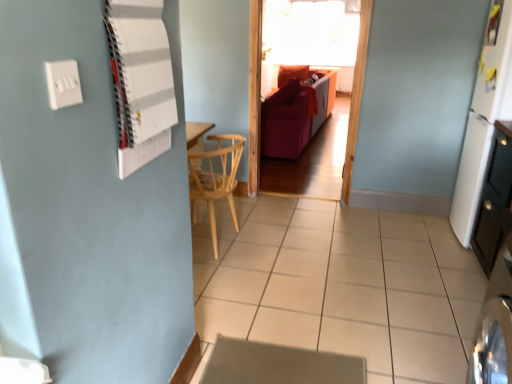
Question: From the image's perspective, is velvet red couch at center above beige carpet at lower center?

Choices:
 (A) no
 (B) yes

Answer: (B)

Question: Is velvet red couch at center surrounding beige carpet at lower center?

Choices:
 (A) no
 (B) yes

Answer: (A)

Question: Is velvet red couch at center outside of beige carpet at lower center?

Choices:
 (A) no
 (B) yes

Answer: (B)

Question: Is velvet red couch at center not close to beige carpet at lower center?

Choices:
 (A) no
 (B) yes

Answer: (B)

Question: Considering the relative sizes of velvet red couch at center and beige carpet at lower center in the image provided, is velvet red couch at center smaller than beige carpet at lower center?

Choices:
 (A) no
 (B) yes

Answer: (A)

Question: In terms of width, does white matte board at upper left look wider or thinner when compared to natural wood chair at center?

Choices:
 (A) thin
 (B) wide

Answer: (A)

Question: Looking at the image, does white matte board at upper left seem bigger or smaller compared to natural wood chair at center?

Choices:
 (A) big
 (B) small

Answer: (B)

Question: Is point (156, 6) positioned closer to the camera than point (229, 198)?

Choices:
 (A) farther
 (B) closer

Answer: (B)

Question: From their relative heights in the image, would you say white matte board at upper left is taller or shorter than natural wood chair at center?

Choices:
 (A) tall
 (B) short

Answer: (B)

Question: Is point (268, 223) positioned closer to the camera than point (506, 205)?

Choices:
 (A) farther
 (B) closer

Answer: (A)

Question: Considering the relative positions of white tile at center and white glossy dresser at right in the image provided, is white tile at center to the left or to the right of white glossy dresser at right?

Choices:
 (A) right
 (B) left

Answer: (B)

Question: Considering their positions, is white tile at center located in front of or behind white glossy dresser at right?

Choices:
 (A) behind
 (B) front

Answer: (B)

Question: From the image's perspective, is white tile at center located above or below white glossy dresser at right?

Choices:
 (A) above
 (B) below

Answer: (B)

Question: From the image's perspective, is white plastic switch at upper left positioned above or below white matte board at upper left?

Choices:
 (A) above
 (B) below

Answer: (B)

Question: Does point click(x=53, y=71) appear closer or farther from the camera than point click(x=122, y=36)?

Choices:
 (A) closer
 (B) farther

Answer: (A)